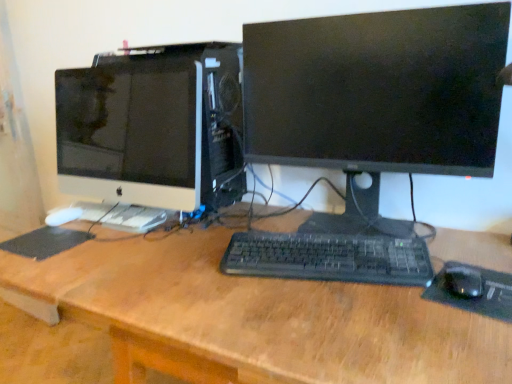
Question: From a real-world perspective, does black plastic keyboard at center stand above white glossy computer monitor at left, positioned as the 1th computer monitor in left-to-right order?

Choices:
 (A) no
 (B) yes

Answer: (A)

Question: From a real-world perspective, is black plastic keyboard at center located beneath white glossy computer monitor at left, positioned as the 1th computer monitor in left-to-right order?

Choices:
 (A) no
 (B) yes

Answer: (B)

Question: Considering the relative sizes of black plastic keyboard at center and white glossy computer monitor at left, positioned as the 1th computer monitor in left-to-right order, in the image provided, is black plastic keyboard at center smaller than white glossy computer monitor at left, positioned as the 1th computer monitor in left-to-right order,?

Choices:
 (A) yes
 (B) no

Answer: (A)

Question: Is black plastic keyboard at center positioned far away from white glossy computer monitor at left, positioned as the 1th computer monitor in left-to-right order?

Choices:
 (A) no
 (B) yes

Answer: (A)

Question: Considering the relative sizes of black plastic keyboard at center and white glossy computer monitor at left, positioned as the 1th computer monitor in left-to-right order, in the image provided, is black plastic keyboard at center taller than white glossy computer monitor at left, positioned as the 1th computer monitor in left-to-right order,?

Choices:
 (A) yes
 (B) no

Answer: (B)

Question: Considering their positions, is black matte monitor at center, which is counted as the first computer monitor, starting from the right, located in front of or behind black matte mousepad at lower left, the 1th mousepad from the back?

Choices:
 (A) front
 (B) behind

Answer: (A)

Question: Considering the positions of black matte monitor at center, which is counted as the first computer monitor, starting from the right, and black matte mousepad at lower left, the 1th mousepad from the back, in the image, is black matte monitor at center, which is counted as the first computer monitor, starting from the right, wider or thinner than black matte mousepad at lower left, the 1th mousepad from the back,?

Choices:
 (A) wide
 (B) thin

Answer: (A)

Question: Is black matte monitor at center, which is counted as the first computer monitor, starting from the right, taller or shorter than black matte mousepad at lower left, which is the 2th mousepad in right-to-left order?

Choices:
 (A) tall
 (B) short

Answer: (A)

Question: From a real-world perspective, is black matte monitor at center, which is counted as the first computer monitor, starting from the right, above or below black matte mousepad at lower left, marked as the first mousepad in a left-to-right arrangement?

Choices:
 (A) below
 (B) above

Answer: (B)

Question: Looking at the image, does white matte keyboard at left seem bigger or smaller compared to white glossy computer monitor at left, positioned as the 1th computer monitor in left-to-right order?

Choices:
 (A) small
 (B) big

Answer: (A)

Question: Considering the positions of white matte keyboard at left and white glossy computer monitor at left, the 2th computer monitor positioned from the right, in the image, is white matte keyboard at left taller or shorter than white glossy computer monitor at left, the 2th computer monitor positioned from the right,?

Choices:
 (A) tall
 (B) short

Answer: (B)

Question: From the image's perspective, relative to white glossy computer monitor at left, positioned as the 1th computer monitor in left-to-right order, is white matte keyboard at left above or below?

Choices:
 (A) below
 (B) above

Answer: (A)

Question: Is white matte keyboard at left in front of or behind white glossy computer monitor at left, the 2th computer monitor positioned from the right, in the image?

Choices:
 (A) front
 (B) behind

Answer: (B)

Question: Is point [x=259, y=336] closer or farther from the camera than point [x=339, y=271]?

Choices:
 (A) farther
 (B) closer

Answer: (B)

Question: In terms of height, does wooden desk at center look taller or shorter compared to black plastic keyboard at center?

Choices:
 (A) short
 (B) tall

Answer: (B)